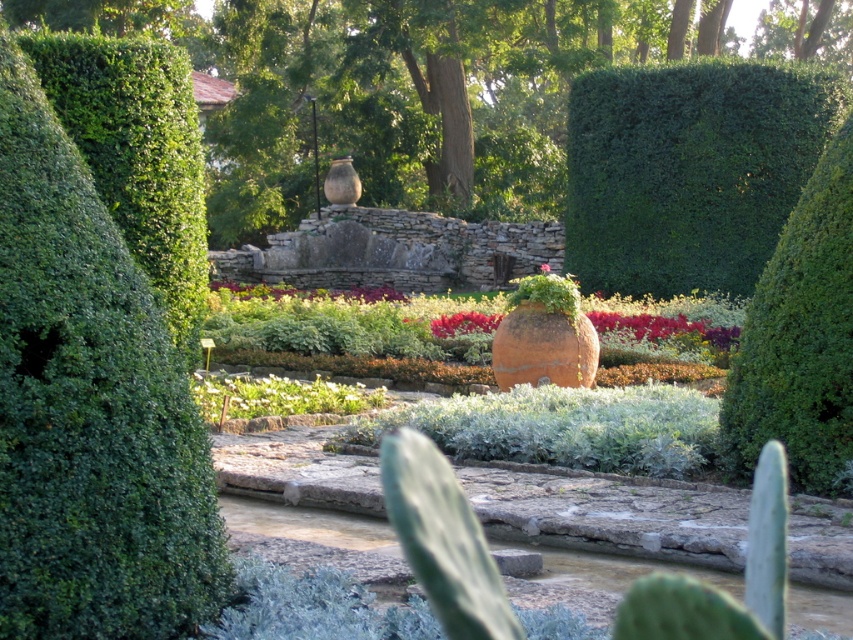
You are a gardener who wants to plant a new flower between the green leafy hedge at left and the green leafy plant at center. Based on their positions, where should you place the new flower?

You should place the new flower between the green leafy hedge at left and the green leafy plant at center, as the green leafy hedge at left is positioned to the left of the green leafy plant at center.

You are a gardener who wants to plant a new flower bed between the green leafy hedge at left and the green leafy plant at center. Based on their current positions, which object is closer to the front of the garden?

The green leafy plant at center is closer to the front of the garden because the green leafy hedge at left is positioned over it, indicating it is further back.

You are a gardener who wants to water the green leafy bush at right and the green leafy hedge at upper right. Which one should you water first if you want to start with the one that is farther away from you?

You should water the green leafy bush at right first because it is behind the green leafy hedge at upper right, making it farther away from you.